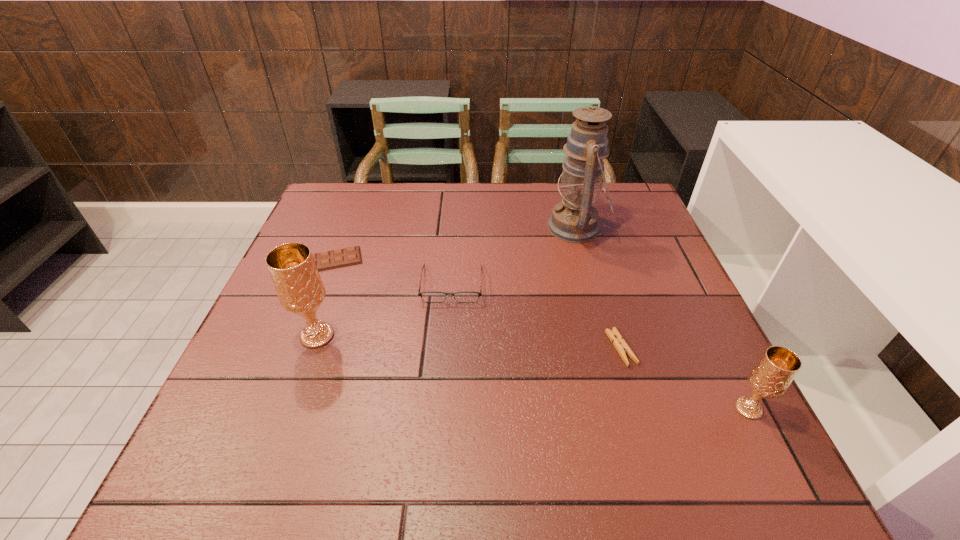
This screenshot has width=960, height=540. In order to click on free space that is in between the chocolate bar and the nearer chalice in this screenshot , I will do `click(540, 334)`.

Find the location of a particular element. empty space that is in between the rightmost object and the oil lamp is located at coordinates (662, 318).

Find the location of a particular element. The height and width of the screenshot is (540, 960). vacant region between the clothespin and the taller chalice is located at coordinates pyautogui.click(x=469, y=342).

What are the coordinates of `vacant space in between the tallest object and the chocolate bar` in the screenshot? It's located at (454, 244).

Locate an element on the screen. Image resolution: width=960 pixels, height=540 pixels. vacant space in between the chocolate bar and the rightmost object is located at coordinates (540, 334).

Locate an element on the screen. The width and height of the screenshot is (960, 540). free area in between the left chalice and the spectacles is located at coordinates (385, 310).

The image size is (960, 540). Find the location of `free space between the tallest object and the chocolate bar`. free space between the tallest object and the chocolate bar is located at coordinates (454, 244).

Image resolution: width=960 pixels, height=540 pixels. In order to click on object that stands as the fourth closest to the chocolate bar in this screenshot , I will do `click(621, 346)`.

Locate which object is the third closest to the rightmost object. Please provide its 2D coordinates. Your answer should be formatted as a tuple, i.e. [(x, y)], where the tuple contains the x and y coordinates of a point satisfying the conditions above.

[(430, 296)]

Where is `vacant space that satisfies the following two spatial constraints: 1. on the front side of the left chalice; 2. on the left side of the clothespin`? vacant space that satisfies the following two spatial constraints: 1. on the front side of the left chalice; 2. on the left side of the clothespin is located at coordinates pyautogui.click(x=313, y=348).